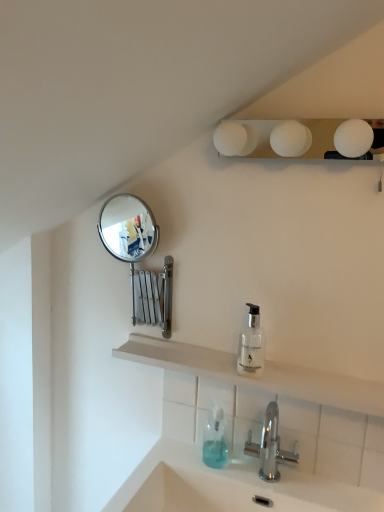
You are a GUI agent. You are given a task and a screenshot of the screen. Output one action in this format:
    pyautogui.click(x=<x>, y=<y>)
    Task: Click on the free point above white matte shelf at center (from a real-world perspective)
    
    Given the screenshot: What is the action you would take?
    pyautogui.click(x=240, y=357)